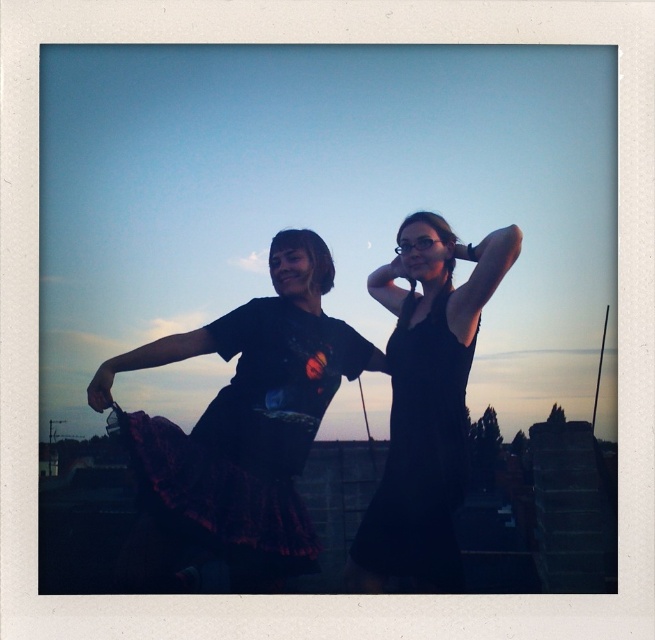
You are an artist trying to draw the scene. You need to place two points on your canvas. The first point is at coordinate point(267, 490) and the second is at point(354, 545). According to the image, which point should be placed further back in the depth compared to the other?

Point(267, 490) is behind point(354, 545), so it should be placed further back in the depth compared to the other.

You are a photographer standing at the camera position. You want to adjust your zoom lens to ensure the black satin dress at center fills the frame. Given that the camera has a minimum focusing distance of 5 meters, will you need to move closer or farther away to achieve this?

The black satin dress at center is 4.91 meters away from the camera. Since the minimum focusing distance is 5 meters, you need to move slightly farther away to reach the required distance of 5 meters to focus properly.

You are an event photographer trying to capture the perfect shot of the black satin dress at center. Based on the coordinates provided, where should you position your camera to ensure the dress is centered in your frame?

The black satin dress at center is located at coordinates point [248,440], so positioning the camera to align the center of the frame with these coordinates will ensure the dress is centered in the shot.